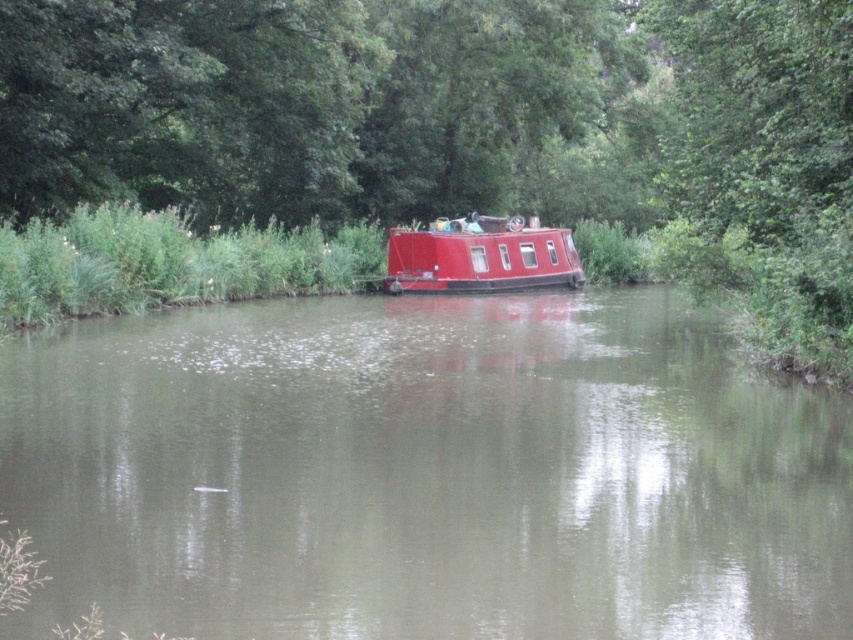
Does point (630, 483) come behind point (520, 278)?

No, (630, 483) is in front of (520, 278).

Does smooth brown water at center appear over shiny red boat at center?

Incorrect, smooth brown water at center is not positioned above shiny red boat at center.

Which is in front, point (686, 577) or point (563, 244)?

Positioned in front is point (686, 577).

Where is `smooth brown water at center`? This screenshot has width=853, height=640. smooth brown water at center is located at coordinates tap(425, 472).